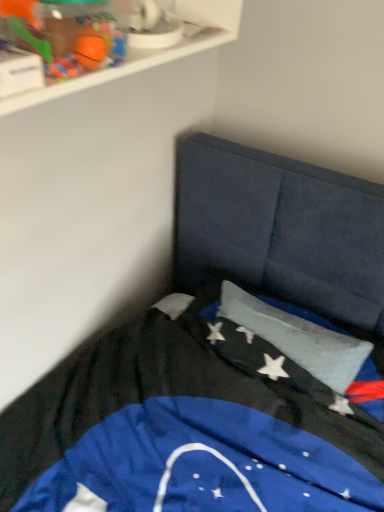
Question: Should I look upward or downward to see rubberized orange ball at upper left?

Choices:
 (A) down
 (B) up

Answer: (B)

Question: From a real-world perspective, is white plastic shelf at upper left located beneath rubberized orange ball at upper left?

Choices:
 (A) no
 (B) yes

Answer: (B)

Question: Is white plastic shelf at upper left at the left side of rubberized orange ball at upper left?

Choices:
 (A) no
 (B) yes

Answer: (A)

Question: Is white plastic shelf at upper left far away from rubberized orange ball at upper left?

Choices:
 (A) no
 (B) yes

Answer: (A)

Question: Is white plastic shelf at upper left aimed at rubberized orange ball at upper left?

Choices:
 (A) yes
 (B) no

Answer: (A)

Question: Is white plastic shelf at upper left positioned behind rubberized orange ball at upper left?

Choices:
 (A) no
 (B) yes

Answer: (A)

Question: From the image's perspective, is white plastic shelf at upper left below rubberized orange ball at upper left?

Choices:
 (A) no
 (B) yes

Answer: (A)

Question: From the image's perspective, is silky blue flag at center located above white plastic shelf at upper left?

Choices:
 (A) yes
 (B) no

Answer: (B)

Question: Is silky blue flag at center thinner than white plastic shelf at upper left?

Choices:
 (A) no
 (B) yes

Answer: (A)

Question: From a real-world perspective, is silky blue flag at center located beneath white plastic shelf at upper left?

Choices:
 (A) no
 (B) yes

Answer: (B)

Question: Can you confirm if silky blue flag at center is taller than white plastic shelf at upper left?

Choices:
 (A) no
 (B) yes

Answer: (B)

Question: Is white plastic shelf at upper left located within silky blue flag at center?

Choices:
 (A) no
 (B) yes

Answer: (A)

Question: Is the surface of silky blue flag at center in direct contact with white plastic shelf at upper left?

Choices:
 (A) no
 (B) yes

Answer: (A)

Question: From the image's perspective, does rubberized orange ball at upper left appear higher than white plastic shelf at upper left?

Choices:
 (A) no
 (B) yes

Answer: (A)